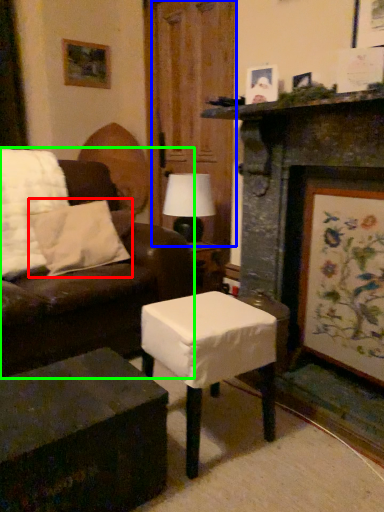
Question: Considering the real-world distances, which object is closest to pillow (highlighted by a red box)? glass door (highlighted by a blue box) or studio couch (highlighted by a green box).

Choices:
 (A) glass door
 (B) studio couch

Answer: (B)